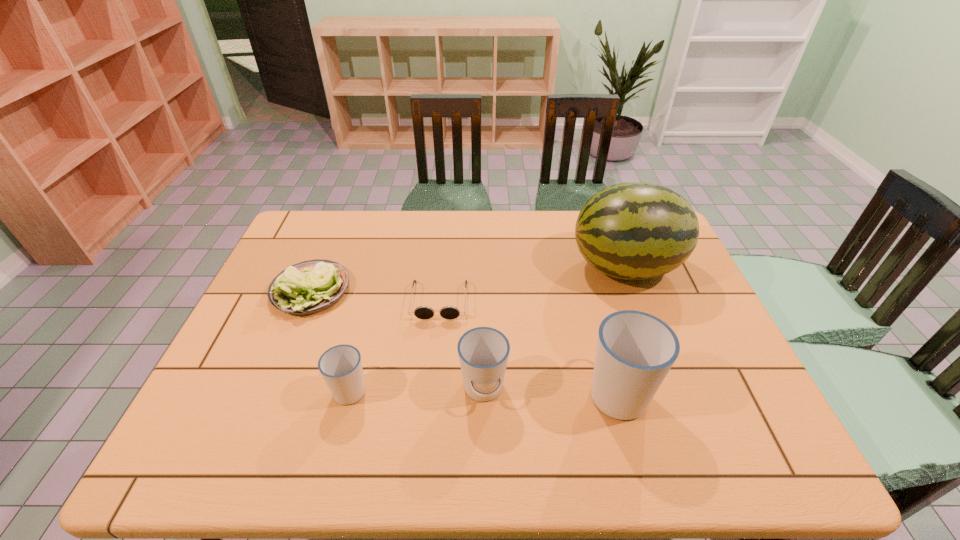
Image resolution: width=960 pixels, height=540 pixels. What are the coordinates of `cup that is the second closest one to the lettuce` in the screenshot? It's located at (483, 352).

Image resolution: width=960 pixels, height=540 pixels. In order to click on vacant space that satisfies the following two spatial constraints: 1. at the stem end of the tallest object; 2. on the front-facing side of the sunglasses in this screenshot , I will do tap(637, 300).